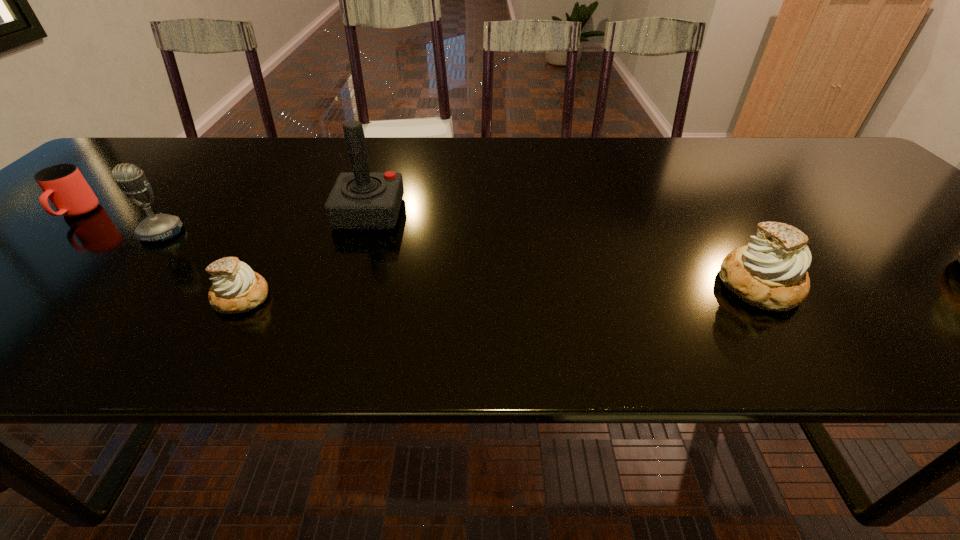
Identify the location of vacant space that satisfies the following two spatial constraints: 1. on the base of the joystick; 2. on the front-facing side of the microphone. Image resolution: width=960 pixels, height=540 pixels. (363, 233).

I want to click on free space that satisfies the following two spatial constraints: 1. on the back side of the third shortest object; 2. on the base of the joystick, so click(709, 213).

The width and height of the screenshot is (960, 540). Identify the location of free space that satisfies the following two spatial constraints: 1. on the base of the second object from right to left; 2. on the front-facing side of the second object from left to right. (363, 233).

Find the location of a particular element. free point that satisfies the following two spatial constraints: 1. on the front-facing side of the second object from left to right; 2. on the left side of the shorter pastry is located at coordinates (105, 297).

Where is `free space in the image that satisfies the following two spatial constraints: 1. on the back side of the right pastry; 2. on the base of the fourth object from left to right`? The height and width of the screenshot is (540, 960). free space in the image that satisfies the following two spatial constraints: 1. on the back side of the right pastry; 2. on the base of the fourth object from left to right is located at coordinates (709, 213).